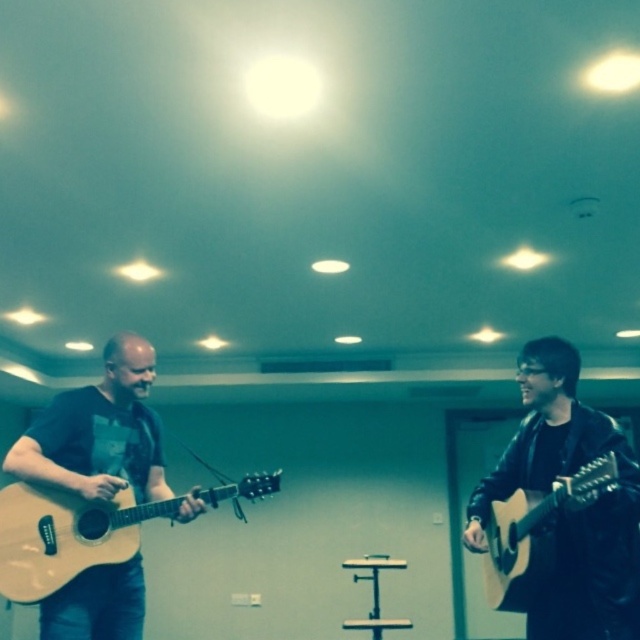
You are a photographer setting up a shoot in the rehearsal room. You want to position a tall tripod between the two guitars so that it doesn not block either instrument. Given the height difference between the matte black guitar at left and the light brown acoustic guitar at left, which guitar should you place the tripod closer to?

The matte black guitar at left is much taller than the light brown acoustic guitar at left. To avoid blocking either instrument, position the tripod closer to the taller matte black guitar at left, as its height provides more vertical space around it.

You are standing in the rehearsal room and want to place a new speaker system at point (572, 515). Is there already an object at that location?

Yes, there is a matte black guitar at right located at point (572, 515).